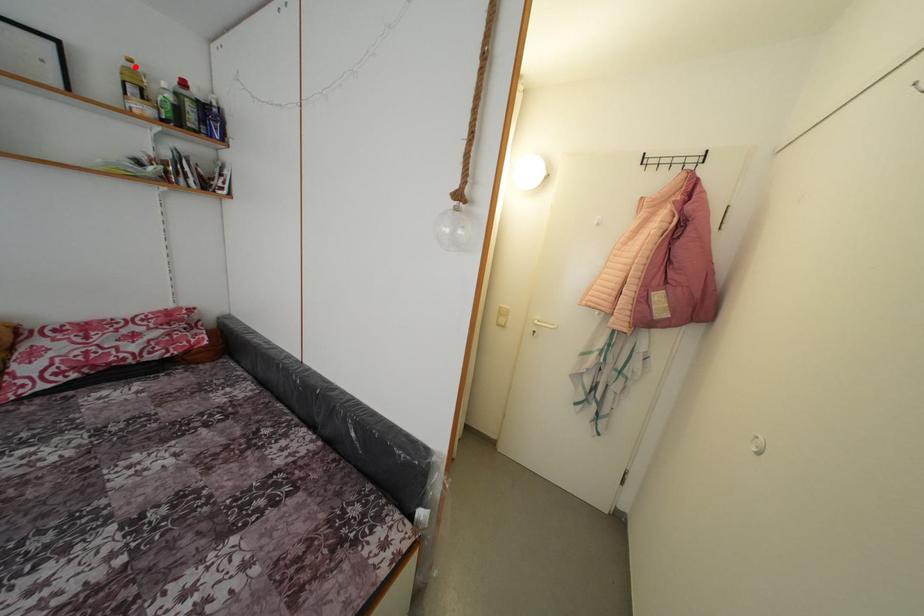
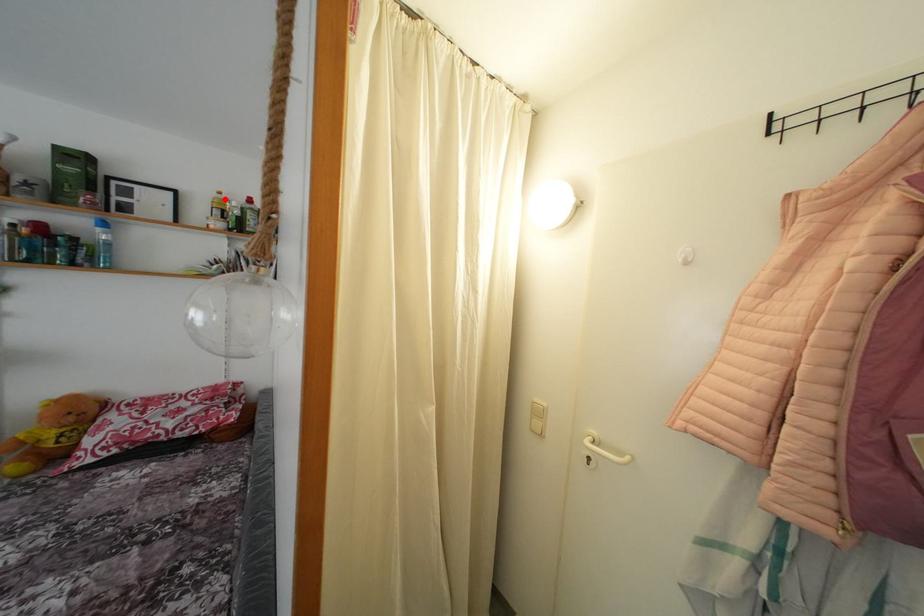
I am providing you with two images of the same scene from different viewpoints. A red point is marked on the first image and another point is marked on the second image. Do the highlighted points in image1 and image2 indicate the same real-world spot?

Yes